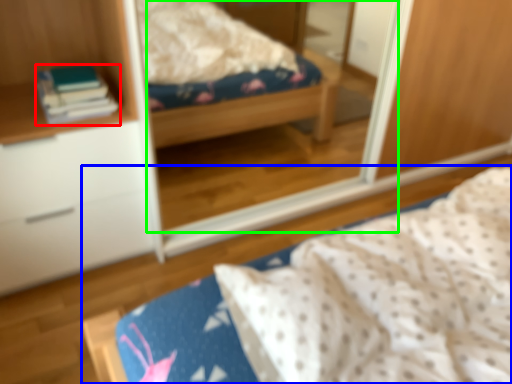
Question: Estimate the real-world distances between objects in this image. Which object is closer to book (highlighted by a red box), bed (highlighted by a blue box) or mirror (highlighted by a green box)?

Choices:
 (A) bed
 (B) mirror

Answer: (A)